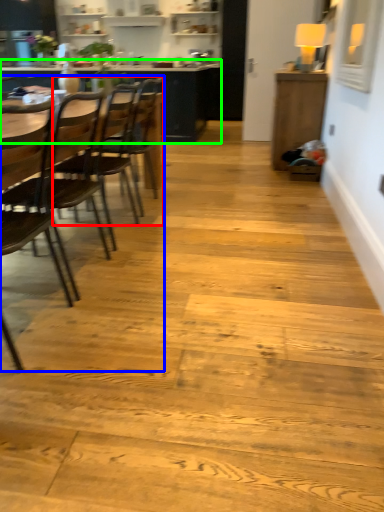
Question: Considering the real-world distances, which object is farthest from chair (highlighted by a red box)? armchair (highlighted by a blue box) or table (highlighted by a green box)?

Choices:
 (A) armchair
 (B) table

Answer: (B)